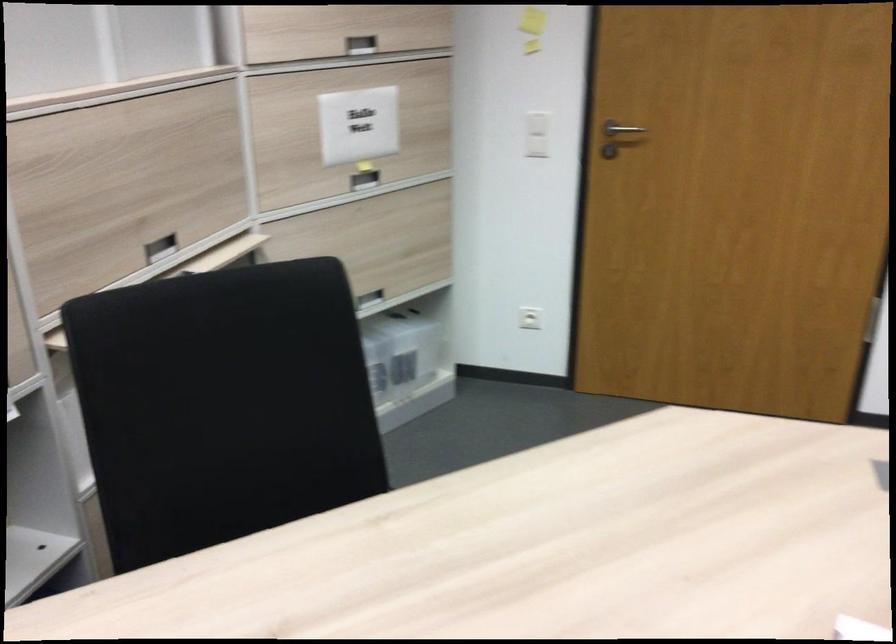
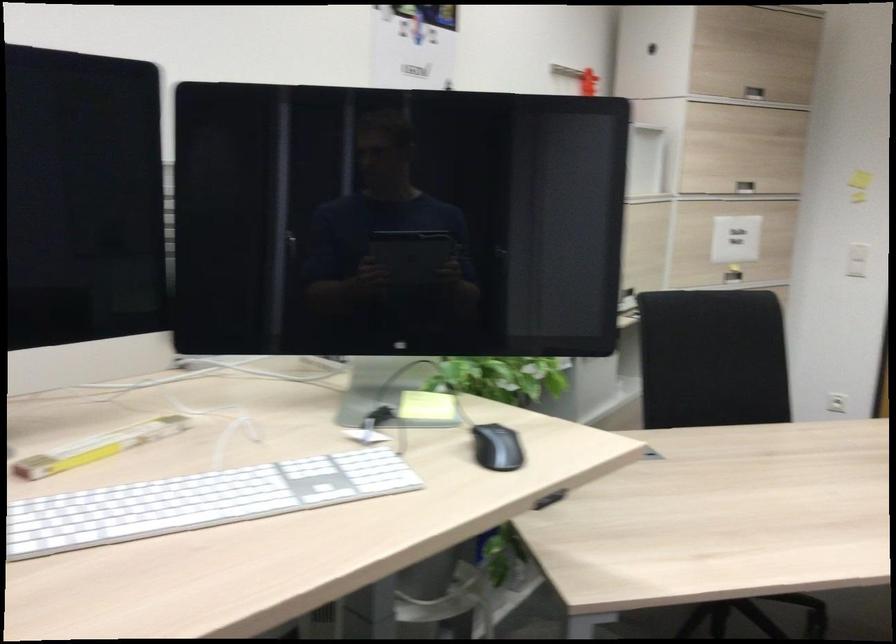
Find the pixel in the second image that matches (x=347, y=182) in the first image.

(733, 275)